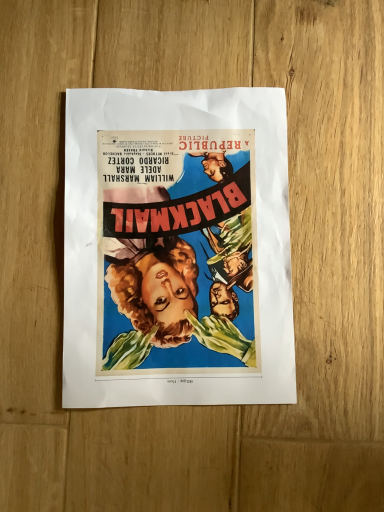
Locate an element on the screen. This screenshot has width=384, height=512. free space above vibrant paper poster at center (from a real-world perspective) is located at coordinates (182, 240).